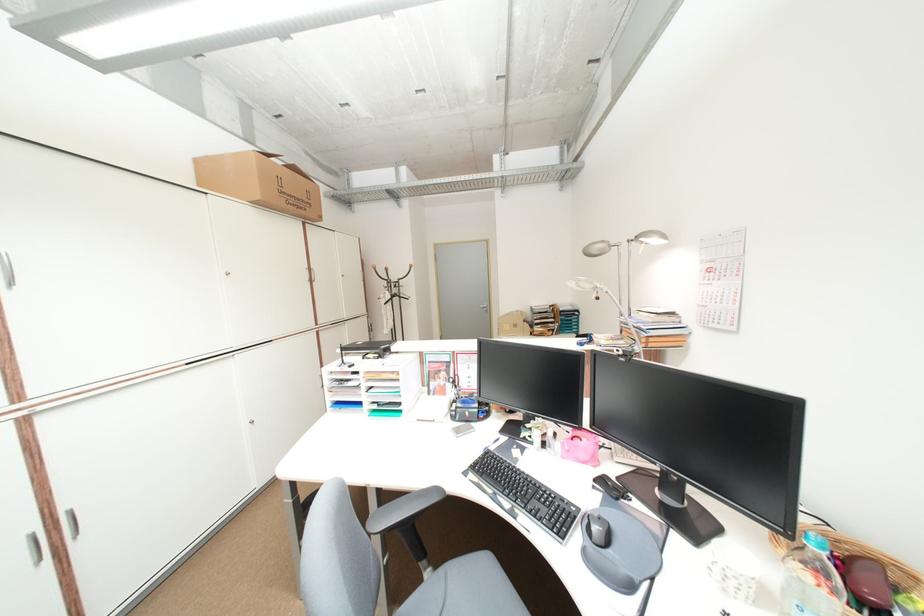
Where is `cardboard box`? This screenshot has width=924, height=616. cardboard box is located at coordinates (259, 183).